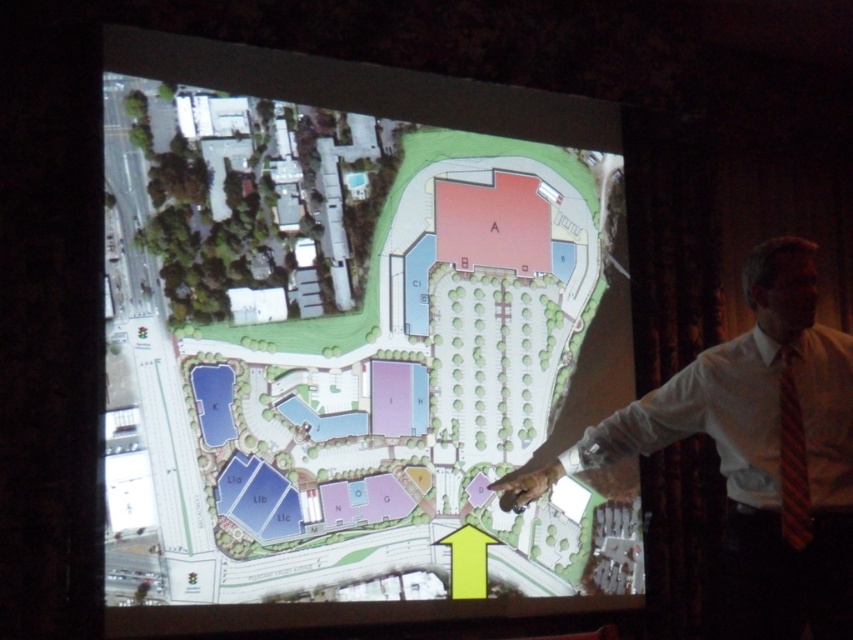
Question: Does white satin dress shirt at center have a smaller size compared to brown striped tie at right?

Choices:
 (A) yes
 (B) no

Answer: (B)

Question: Is white shirt at upper right further to the viewer compared to white satin dress shirt at center?

Choices:
 (A) no
 (B) yes

Answer: (B)

Question: Considering the real-world distances, which object is farthest from the white satin dress shirt at center?

Choices:
 (A) green grass at bottom
 (B) brown striped tie at right

Answer: (A)

Question: Which of the following is the farthest from the observer?

Choices:
 (A) (718, 412)
 (B) (781, 484)
 (C) (744, 374)
 (D) (595, 525)

Answer: (D)

Question: In this image, where is white satin dress shirt at center located relative to brown striped tie at right?

Choices:
 (A) above
 (B) below

Answer: (B)

Question: Which object is closer to the camera taking this photo?

Choices:
 (A) white satin dress shirt at center
 (B) brown striped tie at right
 (C) green grass at bottom

Answer: (A)